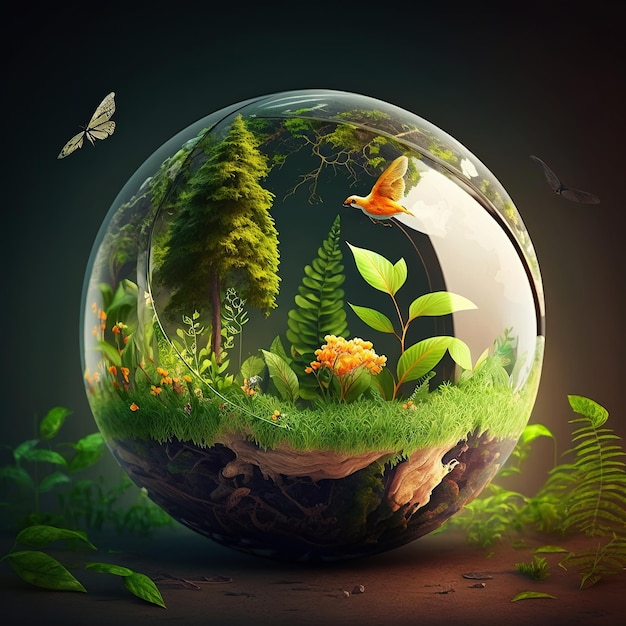
The image size is (626, 626). I want to click on plant, so click(x=434, y=357), click(x=372, y=375), click(x=294, y=377), click(x=217, y=379), click(x=114, y=573), click(x=34, y=464), click(x=593, y=485), click(x=525, y=506).